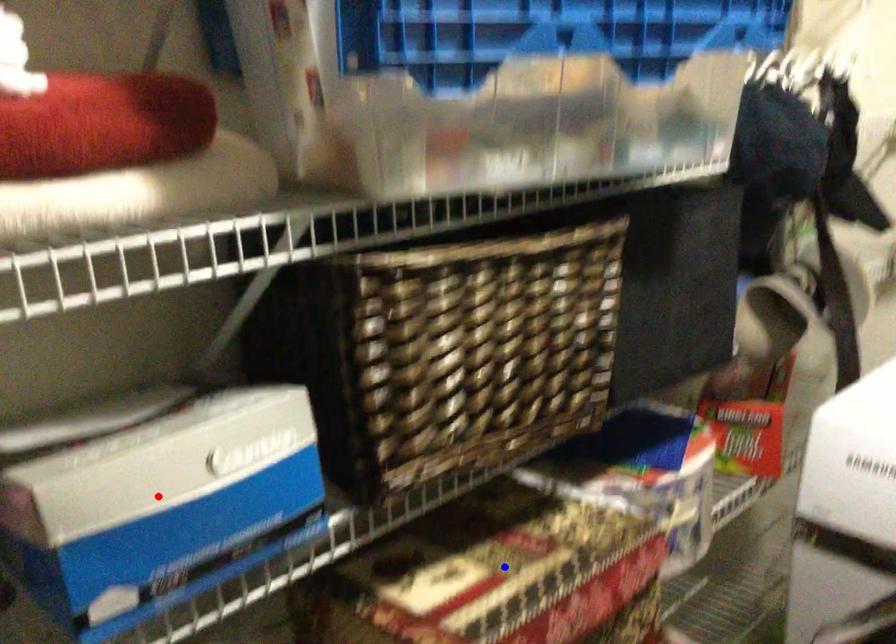
Question: Two points are marked on the image. Which point is closer to the camera?

Choices:
 (A) Blue point is closer.
 (B) Red point is closer.

Answer: (B)